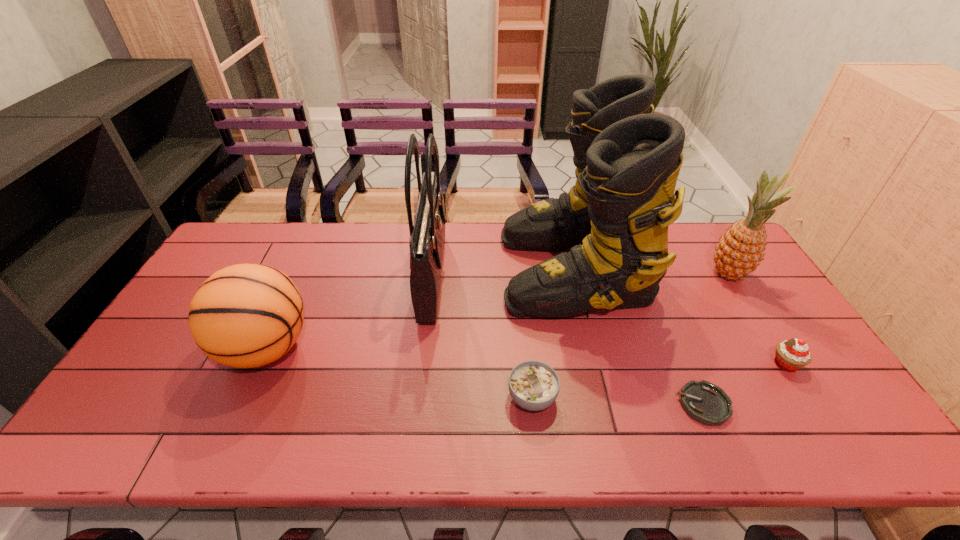
Find the location of a particular element. This screenshot has height=540, width=960. ski boots is located at coordinates (616, 216).

Where is `the second object from left to right`? This screenshot has height=540, width=960. the second object from left to right is located at coordinates (427, 236).

Locate an element on the screen. handbag is located at coordinates (427, 236).

The height and width of the screenshot is (540, 960). What are the coordinates of `pineapple` in the screenshot? It's located at (741, 249).

Where is `the leftmost object`? the leftmost object is located at coordinates (248, 315).

Where is `the fourth tallest object`? This screenshot has height=540, width=960. the fourth tallest object is located at coordinates [x=248, y=315].

This screenshot has width=960, height=540. Identify the location of the fifth tallest object. (791, 355).

At what (x,y) coordinates should I click in order to perform the action: click on soup bowl. Please return your answer as a coordinate pair (x, y). Looking at the image, I should click on (533, 385).

Image resolution: width=960 pixels, height=540 pixels. I want to click on the shortest object, so click(706, 403).

This screenshot has height=540, width=960. Identify the location of free point located on the right of the ski boots. (670, 269).